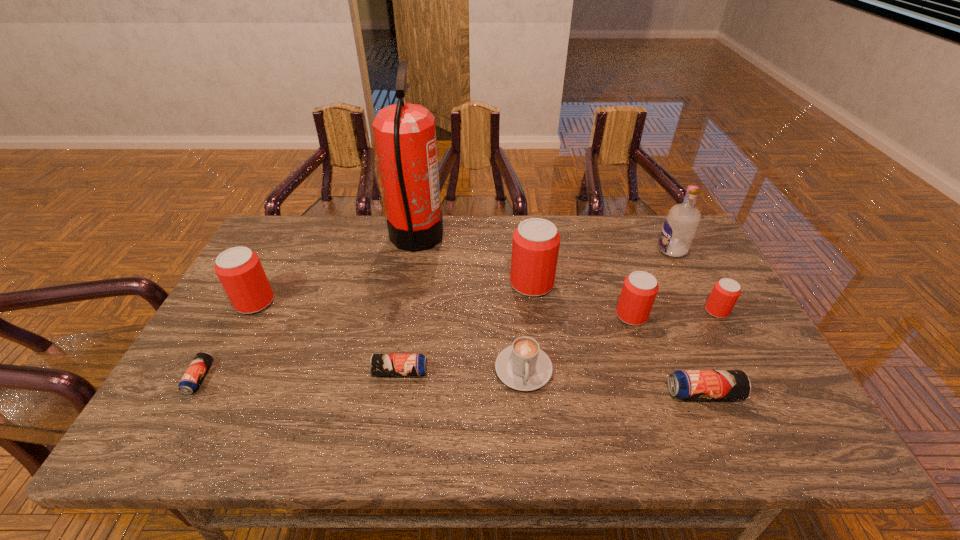
Where is `the tallest object`? This screenshot has height=540, width=960. the tallest object is located at coordinates (405, 135).

What are the coordinates of `fire extinguisher` in the screenshot? It's located at (405, 135).

Image resolution: width=960 pixels, height=540 pixels. Identify the location of vodka. (681, 223).

What are the coordinates of `the tallest beer can` in the screenshot? It's located at (535, 247).

The height and width of the screenshot is (540, 960). Identify the location of the fourth beer can from right to left. (535, 247).

I want to click on the sixth shortest beer can, so click(239, 269).

Locate an element on the screen. This screenshot has width=960, height=540. the second biggest red beer can is located at coordinates (239, 269).

What are the coordinates of `the fifth tallest object` in the screenshot? It's located at (640, 288).

Where is `the third red beer can from left to right`? Image resolution: width=960 pixels, height=540 pixels. the third red beer can from left to right is located at coordinates (640, 288).

Identify the location of the rightmost beer can. (725, 293).